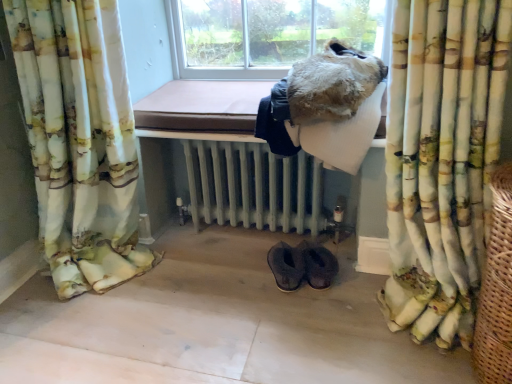
The width and height of the screenshot is (512, 384). Identify the location of free space in front of floral fabric curtain at left, which appears as the 1th curtain when viewed from the left. (88, 344).